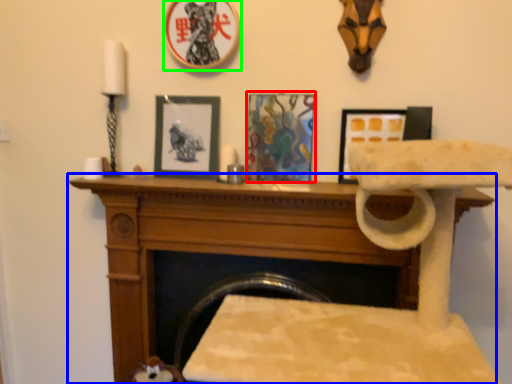
Question: Estimate the real-world distances between objects in this image. Which object is farther from picture frame (highlighted by a red box), furniture (highlighted by a blue box) or picture frame (highlighted by a green box)?

Choices:
 (A) furniture
 (B) picture frame

Answer: (B)